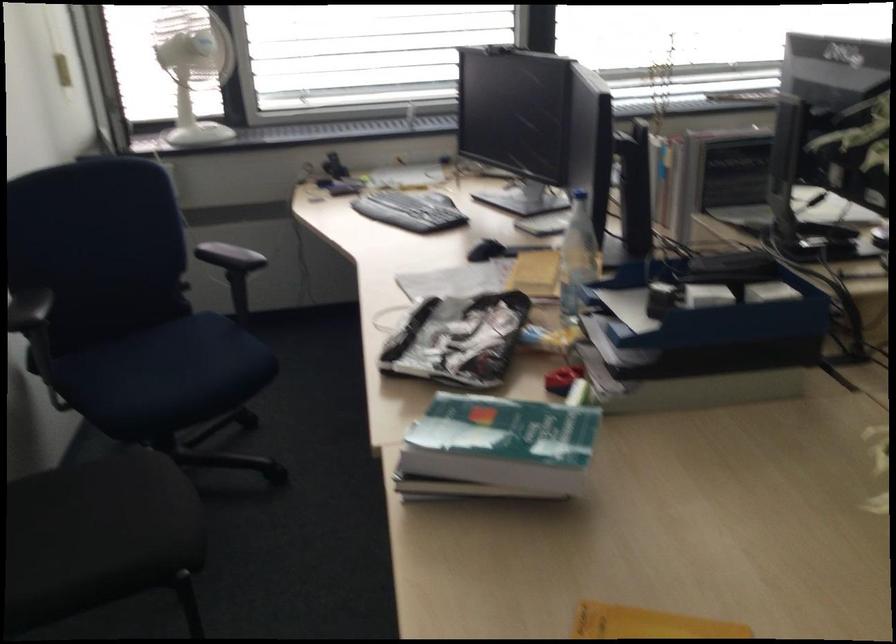
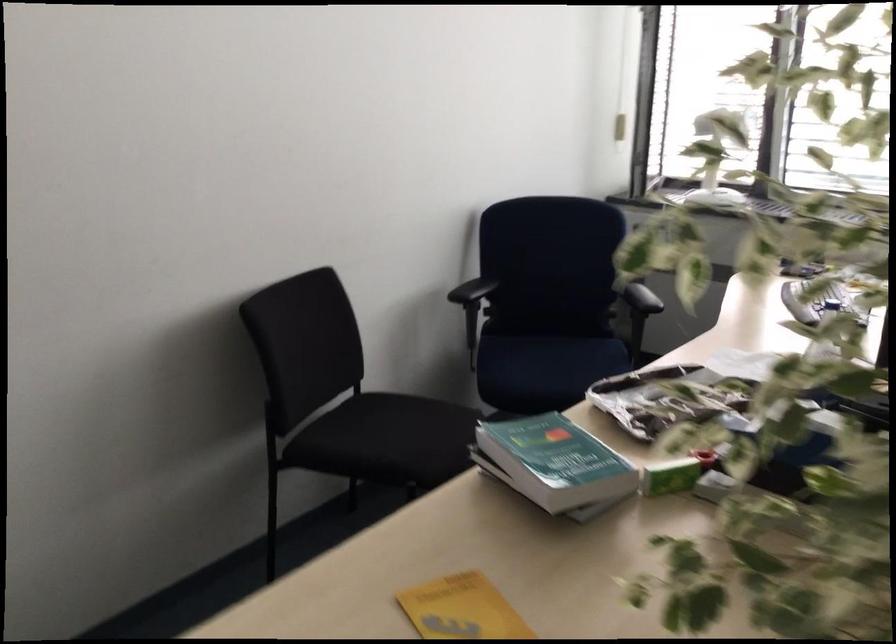
The point at (515, 433) is marked in the first image. Where is the corresponding point in the second image?

(554, 462)